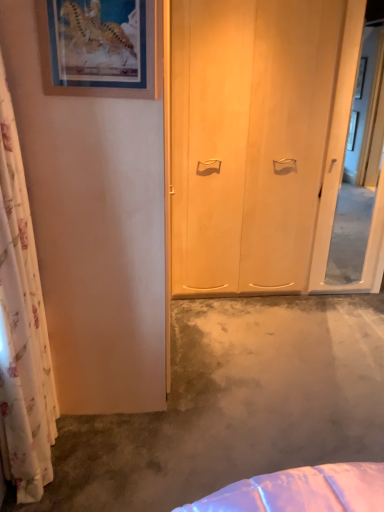
Question: From a real-world perspective, is white floral curtain at left physically located above or below transparent glass screen door at right?

Choices:
 (A) below
 (B) above

Answer: (A)

Question: Would you say white floral curtain at left is inside or outside transparent glass screen door at right?

Choices:
 (A) outside
 (B) inside

Answer: (A)

Question: Based on their relative distances, which object is farther from the wooden picture frame at upper left?

Choices:
 (A) white floral curtain at left
 (B) concreteroughconcrete at center
 (C) transparent glass screen door at right

Answer: (C)

Question: Considering the real-world distances, which object is farthest from the transparent glass screen door at right?

Choices:
 (A) white floral curtain at left
 (B) concreteroughconcrete at center
 (C) wooden picture frame at upper left

Answer: (A)